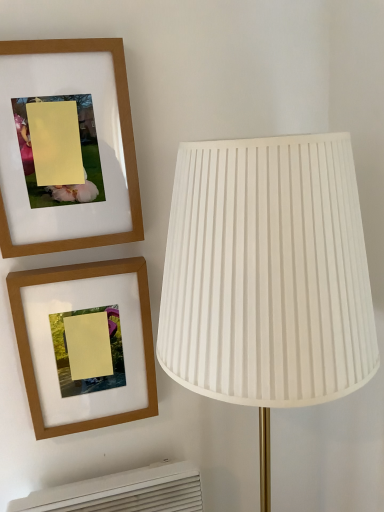
Question: Looking at the image, does white pleated fabric lampshade at right seem bigger or smaller compared to white plastic air conditioner at lower left?

Choices:
 (A) small
 (B) big

Answer: (B)

Question: Considering the positions of white pleated fabric lampshade at right and white plastic air conditioner at lower left in the image, is white pleated fabric lampshade at right taller or shorter than white plastic air conditioner at lower left?

Choices:
 (A) tall
 (B) short

Answer: (A)

Question: Considering the real-world distances, which object is closest to the white plastic air conditioner at lower left?

Choices:
 (A) white pleated fabric lampshade at right
 (B) wooden frame at upper left, the 1th picture frame viewed from the top
 (C) wooden frame at upper left, the first picture frame ordered from the bottom

Answer: (C)

Question: Which is farther from the white pleated fabric lampshade at right?

Choices:
 (A) white plastic air conditioner at lower left
 (B) wooden frame at upper left, the 1th picture frame viewed from the top
 (C) wooden frame at upper left, the first picture frame ordered from the bottom

Answer: (A)